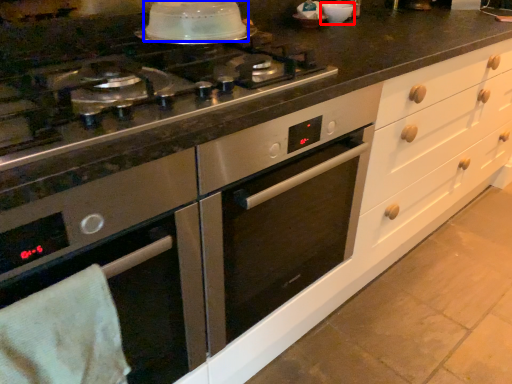
Question: Among these objects, which one is farthest to the camera, appliance (highlighted by a red box) or kitchen appliance (highlighted by a blue box)?

Choices:
 (A) appliance
 (B) kitchen appliance

Answer: (A)